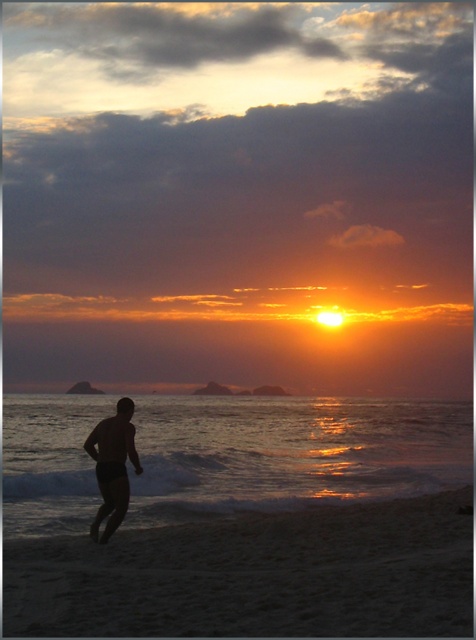
You are standing on the beach looking at the sunset. There is a point at coordinates (256,573). Based on the scene description, what is located at that point?

The point at coordinates (256,573) corresponds to the sandy beach at lower center.